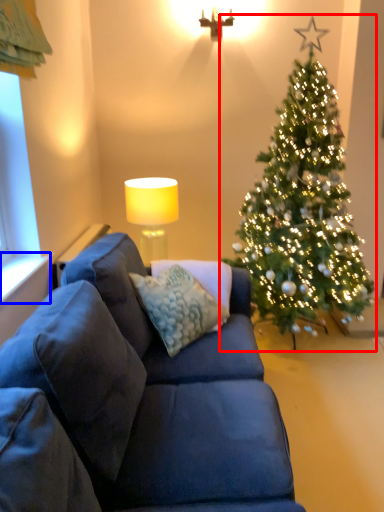
Question: Among these objects, which one is nearest to the camera, christmas tree (highlighted by a red box) or window sill (highlighted by a blue box)?

Choices:
 (A) christmas tree
 (B) window sill

Answer: (B)